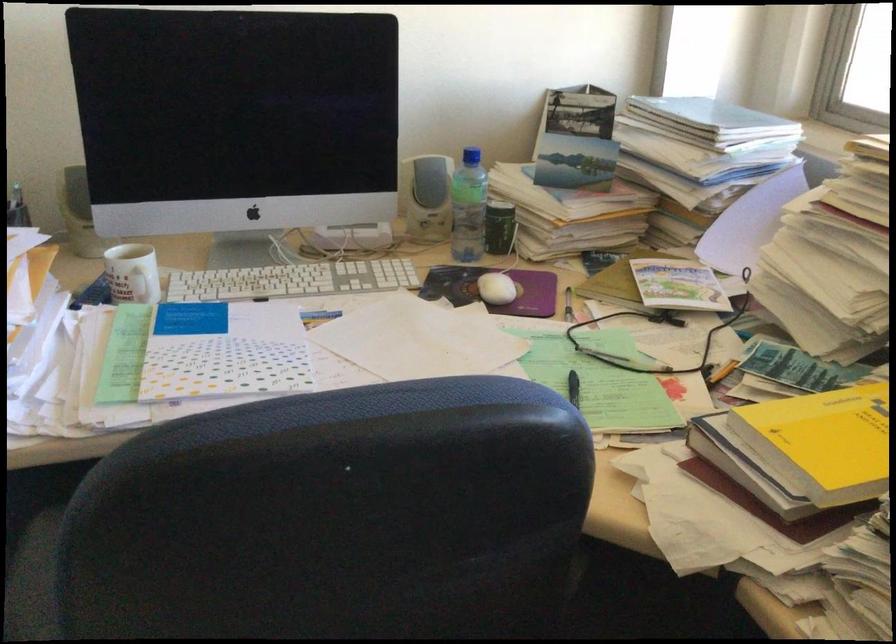
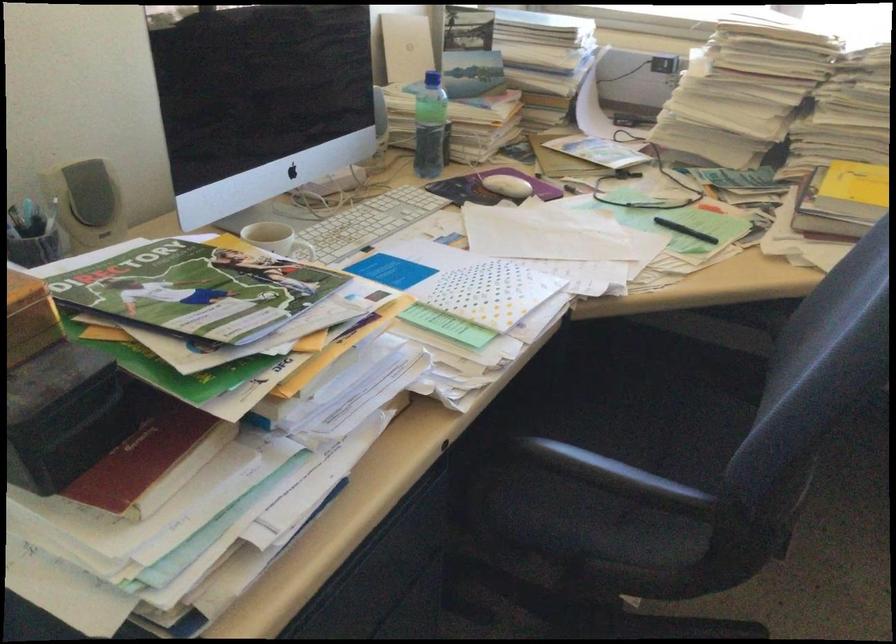
The point at (477, 287) is marked in the first image. Where is the corresponding point in the second image?

(506, 185)